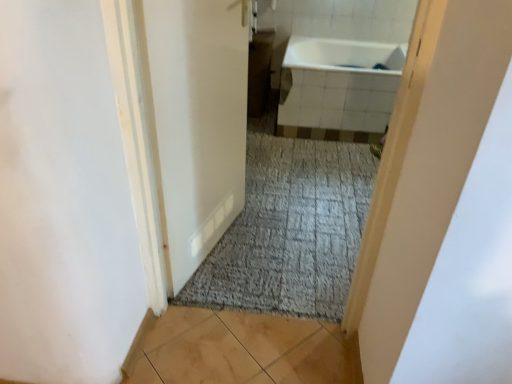
Question: Considering the relative sizes of white glossy door at center and light brown tile at lower center in the image provided, is white glossy door at center thinner than light brown tile at lower center?

Choices:
 (A) no
 (B) yes

Answer: (B)

Question: From a real-world perspective, is white glossy door at center positioned under light brown tile at lower center based on gravity?

Choices:
 (A) no
 (B) yes

Answer: (A)

Question: From the image's perspective, is white glossy door at center below light brown tile at lower center?

Choices:
 (A) no
 (B) yes

Answer: (A)

Question: Considering the relative sizes of white glossy door at center and light brown tile at lower center in the image provided, is white glossy door at center wider than light brown tile at lower center?

Choices:
 (A) yes
 (B) no

Answer: (B)

Question: Are white glossy door at center and light brown tile at lower center located far from each other?

Choices:
 (A) yes
 (B) no

Answer: (B)

Question: Is white glossy door at center outside of light brown tile at lower center?

Choices:
 (A) yes
 (B) no

Answer: (A)

Question: Is white glossy bathtub at upper center to the left of white glossy door at center from the viewer's perspective?

Choices:
 (A) yes
 (B) no

Answer: (B)

Question: Is white glossy bathtub at upper center outside white glossy door at center?

Choices:
 (A) yes
 (B) no

Answer: (A)

Question: Does white glossy bathtub at upper center have a greater height compared to white glossy door at center?

Choices:
 (A) yes
 (B) no

Answer: (B)

Question: Is white glossy bathtub at upper center beside white glossy door at center?

Choices:
 (A) yes
 (B) no

Answer: (B)

Question: Could you tell me if white glossy bathtub at upper center is facing white glossy door at center?

Choices:
 (A) no
 (B) yes

Answer: (B)

Question: Is white glossy bathtub at upper center thinner than white glossy door at center?

Choices:
 (A) yes
 (B) no

Answer: (B)

Question: Is white glossy door at center closer to the viewer compared to white glossy bathtub at upper center?

Choices:
 (A) yes
 (B) no

Answer: (A)